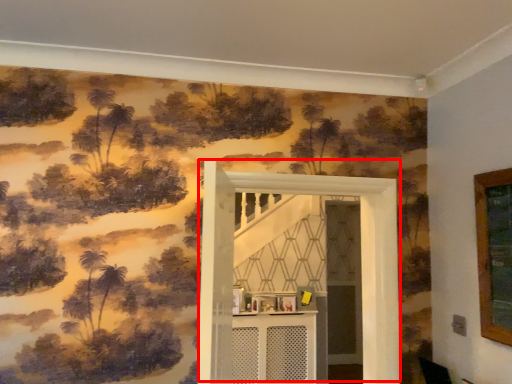
Question: Observing the image, what is the correct spatial positioning of door (annotated by the red box) in reference to table?

Choices:
 (A) left
 (B) right

Answer: (B)